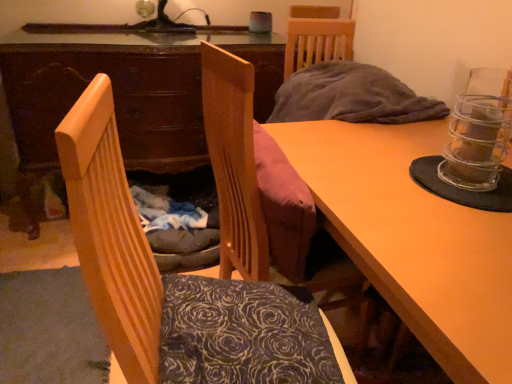
Question: Choose the correct answer: Is dark floral fabric pillow at center inside velvet pink cushion at center, the second chair from the front, or outside it?

Choices:
 (A) outside
 (B) inside

Answer: (A)

Question: Does point (217, 347) appear closer or farther from the camera than point (216, 157)?

Choices:
 (A) farther
 (B) closer

Answer: (B)

Question: Based on their relative distances, which object is farther from the wooden chair at left, marked as the 1th chair in a front-to-back arrangement?

Choices:
 (A) dark floral fabric pillow at center
 (B) wooden table at center
 (C) wooden desk at center
 (D) velvet pink cushion at center, the second chair from the front

Answer: (C)

Question: Based on their relative distances, which object is farther from the velvet pink cushion at center, placed as the 1th chair when sorted from back to front?

Choices:
 (A) dark floral fabric pillow at center
 (B) wooden desk at center
 (C) wooden chair at left, marked as the 1th chair in a front-to-back arrangement
 (D) wooden table at center

Answer: (B)